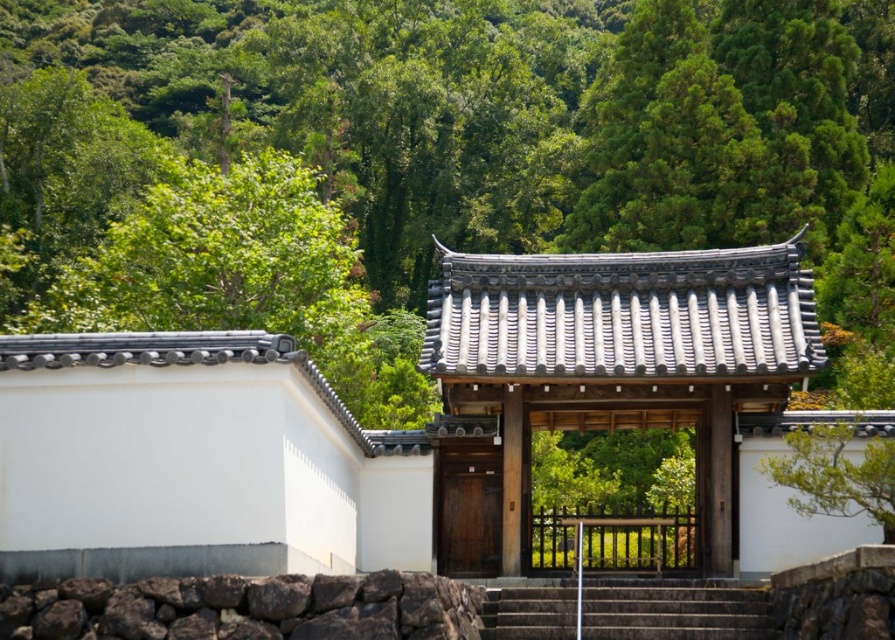
You are standing in front of the wooden door at center and want to reach the dark gray stone stairs at center. Which direction should you move to get there?

You should move downward to reach the dark gray stone stairs at center because they are located below the wooden door at center.

You are standing in front of the wooden gate with a dark brown finish and notice the dark brown rough stone at lower center. Based on its coordinates, where exactly is the dark brown rough stone positioned relative to the gate?

The dark brown rough stone at lower center is located at point coordinates of 0.952 on the x axis and 0.277 on the y axis, so it is positioned to the far right and slightly above the bottom center relative to the gate.